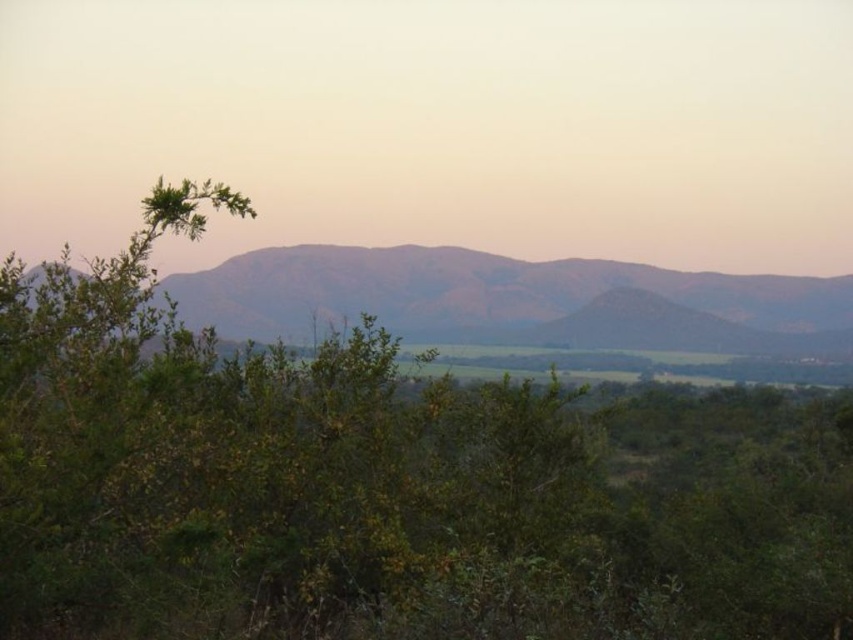
You are standing in the serene landscape and want to take a photo of both the green leafy bush at center and the dull brown mountain range at center. Which object should you focus on first to ensure both are in the frame?

You should focus on the green leafy bush at center first because it is located below the dull brown mountain range at center, so adjusting the camera to include the lower positioned bush will naturally include the mountain range above it.